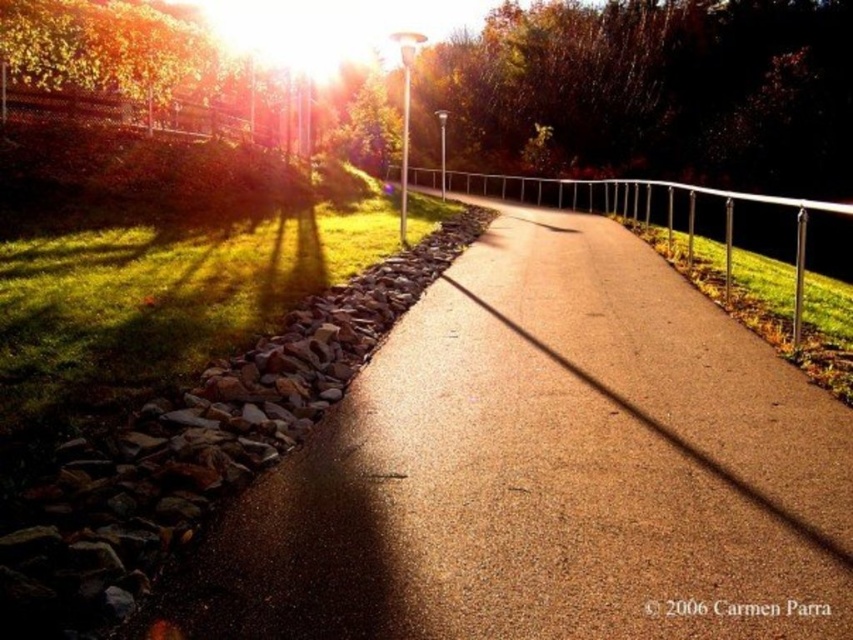
Question: Which point is farther from the camera taking this photo?

Choices:
 (A) (88, 449)
 (B) (97, 100)
 (C) (723, 284)
 (D) (631, 433)

Answer: (B)

Question: Considering the real-world distances, which object is farthest from the silver metallic fence at center?

Choices:
 (A) brown rough stones at lower left
 (B) wooden fence at upper left
 (C) smooth asphalt road at center

Answer: (A)

Question: Is the position of brown rough stones at lower left less distant than that of wooden fence at upper left?

Choices:
 (A) yes
 (B) no

Answer: (A)

Question: Can you confirm if silver metallic fence at center is positioned below wooden fence at upper left?

Choices:
 (A) no
 (B) yes

Answer: (B)

Question: From the image, what is the correct spatial relationship of silver metallic fence at center in relation to wooden fence at upper left?

Choices:
 (A) above
 (B) below

Answer: (B)

Question: Which point is closer to the camera?

Choices:
 (A) click(628, 528)
 (B) click(607, 188)
 (C) click(258, 385)

Answer: (A)